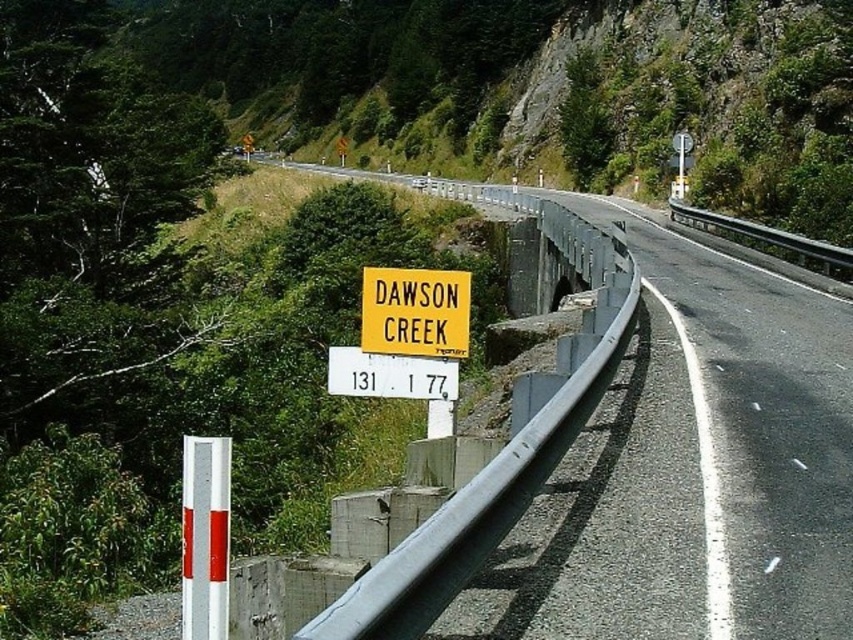
Question: Which object appears closest to the camera in this image?

Choices:
 (A) yellow plastic sign at center
 (B) yellow matte sign at center

Answer: (A)

Question: In this image, where is yellow plastic sign at center located relative to yellow matte sign at center?

Choices:
 (A) left
 (B) right

Answer: (B)

Question: Does yellow plastic sign at center have a smaller size compared to yellow matte sign at center?

Choices:
 (A) yes
 (B) no

Answer: (B)

Question: Among these points, which one is farthest from the camera?

Choices:
 (A) (810, 624)
 (B) (363, 326)

Answer: (B)

Question: Does yellow plastic sign at center lie behind yellow matte sign at center?

Choices:
 (A) yes
 (B) no

Answer: (B)

Question: Among these objects, which one is farthest from the camera?

Choices:
 (A) yellow matte sign at center
 (B) yellow plastic sign at center

Answer: (A)